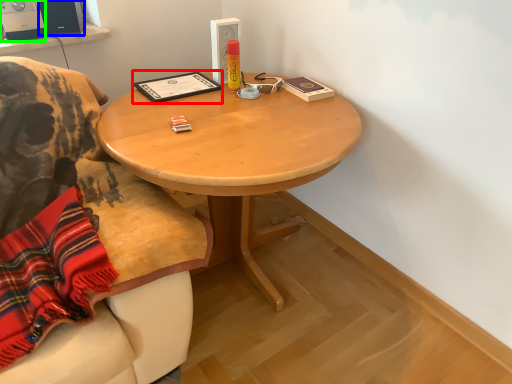
Question: Estimate the real-world distances between objects in this image. Which object is closer to book (highlighted by a red box), loudspeaker (highlighted by a blue box) or loudspeaker (highlighted by a green box)?

Choices:
 (A) loudspeaker
 (B) loudspeaker

Answer: (A)